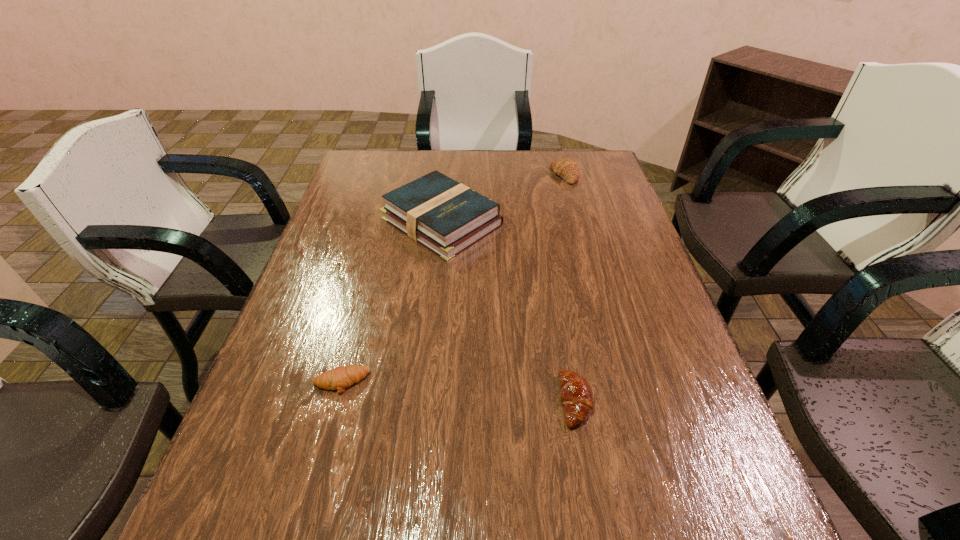
Where is `the tallest object`? The width and height of the screenshot is (960, 540). the tallest object is located at coordinates (445, 216).

You are a GUI agent. You are given a task and a screenshot of the screen. Output one action in this format:
    pyautogui.click(x=<x>, y=<y>)
    Task: Click on the third nearest object
    
    Given the screenshot: What is the action you would take?
    pyautogui.click(x=445, y=216)

Where is `the tallest crescent roll`? This screenshot has height=540, width=960. the tallest crescent roll is located at coordinates (566, 168).

At what (x,y) coordinates should I click in order to perform the action: click on the farthest crescent roll. Please return your answer as a coordinate pair (x, y). This screenshot has height=540, width=960. Looking at the image, I should click on (566, 168).

What are the coordinates of `the second tallest crescent roll` in the screenshot? It's located at (576, 394).

Identify the location of the second object from right to left. (576, 394).

Identify the location of the shortest crescent roll. This screenshot has width=960, height=540. (339, 378).

Locate an element on the screen. The width and height of the screenshot is (960, 540). the shortest object is located at coordinates (339, 378).

Locate an element on the screen. The height and width of the screenshot is (540, 960). free space located 0.260m on the back of the tallest object is located at coordinates (449, 151).

In order to click on free space located on the back of the farthest crescent roll in this screenshot , I will do `click(558, 151)`.